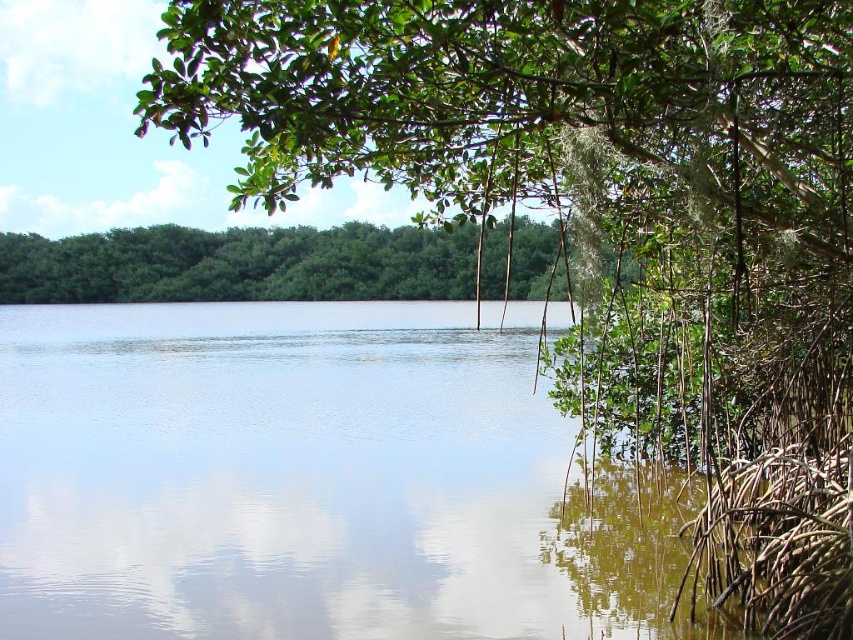
Is clear water at center shorter than green leafy trees at center?

No, clear water at center is not shorter than green leafy trees at center.

Can you confirm if clear water at center is wider than green leafy trees at center?

Yes, clear water at center is wider than green leafy trees at center.

Between point (393, 321) and point (38, 280), which one is positioned behind?

The point (393, 321) is more distant.

Locate an element on the screen. clear water at center is located at coordinates (299, 480).